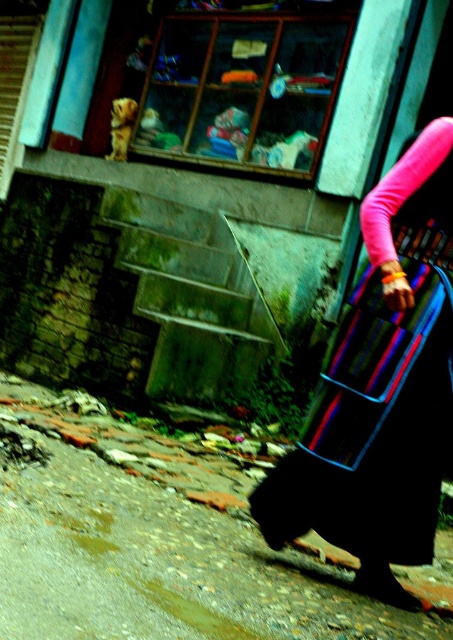
You are a delivery robot that needs to navigate through the brick pavement at lower left and the multicolored woven bag at right. Which path should you choose to ensure you can pass through without getting stuck?

The brick pavement at lower left is wider than the multicolored woven bag at right, so the delivery robot should choose the brick pavement at lower left to pass through without getting stuck.

You are a delivery person trying to navigate through the brick pavement at lower left and the multicolored woven bag at right. Which object is taller?

The multicolored woven bag at right is taller than the brick pavement at lower left.

You are a delivery person trying to navigate through the urban area shown. You need to place a package on the ground near the multicolored woven bag at right. Which direction should you move relative to the brick pavement at lower left to reach the drop point?

The brick pavement at lower left is to the left of the multicolored woven bag at right, so you should move to the right from the brick pavement at lower left to reach the drop point near the multicolored woven bag at right.